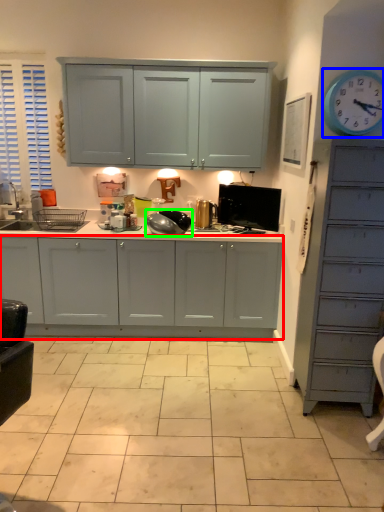
Question: Estimate the real-world distances between objects in this image. Which object is closer to cabinetry (highlighted by a red box), clock (highlighted by a blue box) or appliance (highlighted by a green box)?

Choices:
 (A) clock
 (B) appliance

Answer: (B)